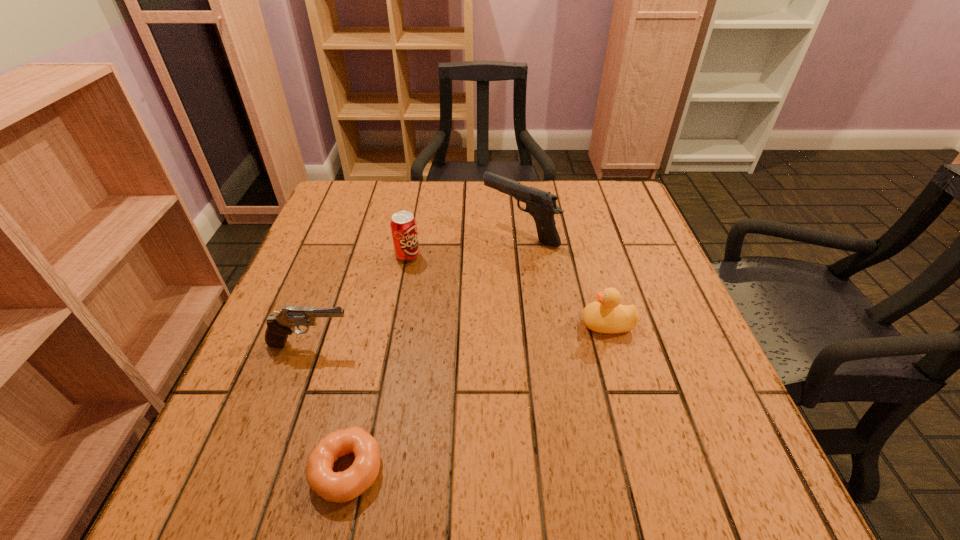
Locate an element on the screen. free point between the pistol and the rightmost object is located at coordinates (459, 334).

Where is `free space between the duck and the tallest object`? The image size is (960, 540). free space between the duck and the tallest object is located at coordinates (564, 278).

I want to click on free spot between the soda and the tallest object, so click(x=464, y=244).

Locate an element on the screen. free space between the soda and the fourth farthest object is located at coordinates (359, 300).

Where is `empty space that is in between the soda and the doughnut`? This screenshot has width=960, height=540. empty space that is in between the soda and the doughnut is located at coordinates (x=377, y=363).

Where is `free area in between the soda and the shortest object`? Image resolution: width=960 pixels, height=540 pixels. free area in between the soda and the shortest object is located at coordinates (377, 363).

Choose which object is the second nearest neighbor to the soda. Please provide its 2D coordinates. Your answer should be formatted as a tuple, i.e. [(x, y)], where the tuple contains the x and y coordinates of a point satisfying the conditions above.

[(279, 326)]

You are a GUI agent. You are given a task and a screenshot of the screen. Output one action in this format:
    pyautogui.click(x=<x>, y=<y>)
    Task: Click on the object that ranks as the fourth closest to the gun
    
    Given the screenshot: What is the action you would take?
    pyautogui.click(x=340, y=487)

Where is `vacant space that satisfies the following two spatial constraints: 1. at the barrel of the doughnut; 2. on the left side of the fourth farthest object`? vacant space that satisfies the following two spatial constraints: 1. at the barrel of the doughnut; 2. on the left side of the fourth farthest object is located at coordinates (264, 470).